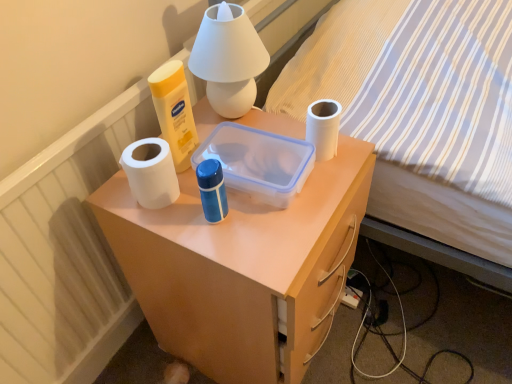
Question: Relative to white matte table lamp at upper center, is striped fabric bed at upper right in front or behind?

Choices:
 (A) behind
 (B) front

Answer: (B)

Question: From a real-world perspective, is striped fabric bed at upper right physically located above or below white matte table lamp at upper center?

Choices:
 (A) below
 (B) above

Answer: (A)

Question: Considering the real-world distances, which object is closest to the white matte toilet paper at right?

Choices:
 (A) striped fabric bed at upper right
 (B) white matte desk at center
 (C) white matte table lamp at upper center
 (D) white matte paper towel at left

Answer: (C)

Question: Based on their relative distances, which object is nearer to the white matte toilet paper at right?

Choices:
 (A) white matte desk at center
 (B) striped fabric bed at upper right
 (C) white matte paper towel at left
 (D) white matte table lamp at upper center

Answer: (D)